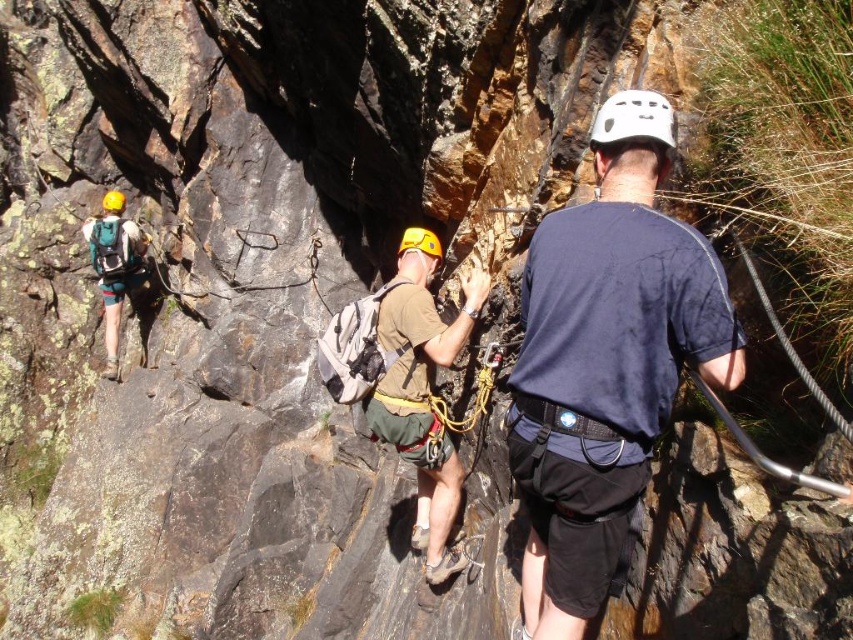
Is dark blue t-shirt at center shorter than brown fabric shirt at center?

Correct, dark blue t-shirt at center is not as tall as brown fabric shirt at center.

Describe the element at coordinates (606, 362) in the screenshot. I see `dark blue t-shirt at center` at that location.

This screenshot has width=853, height=640. In order to click on dark blue t-shirt at center in this screenshot , I will do `click(606, 362)`.